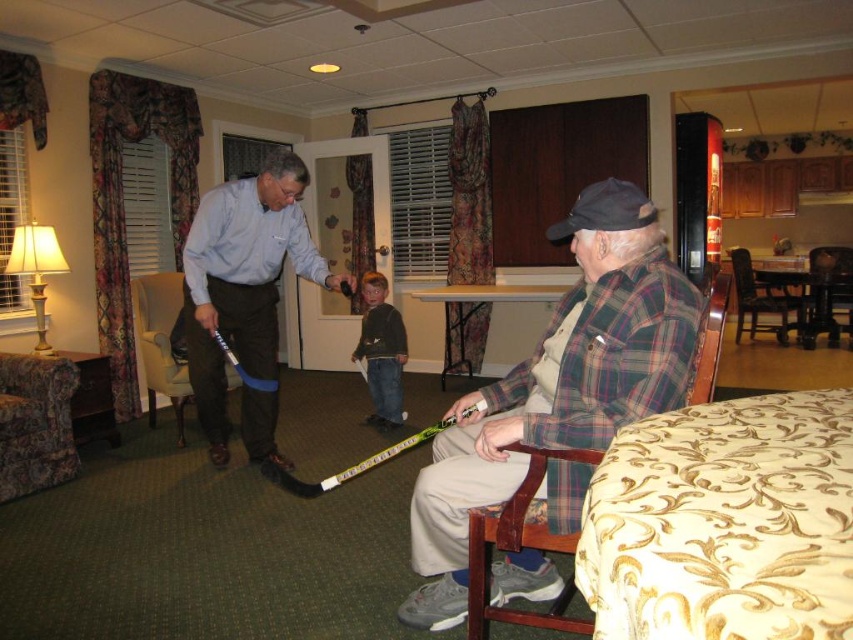
Who is shorter, dark gray fleece jacket at center or wooden chair at right?

With less height is wooden chair at right.

The width and height of the screenshot is (853, 640). What are the coordinates of `dark gray fleece jacket at center` in the screenshot? It's located at (381, 352).

Locate an element on the screen. The image size is (853, 640). dark gray fleece jacket at center is located at coordinates (381, 352).

Is wooden armchair at lower center further to the viewer compared to wooden chair at right?

Answer: No, wooden armchair at lower center is closer to the viewer.

Between wooden armchair at lower center and wooden chair at right, which one appears on the left side from the viewer's perspective?

wooden armchair at lower center is more to the left.

Is point (490, 515) more distant than point (822, 314)?

No, it is not.

You are a GUI agent. You are given a task and a screenshot of the screen. Output one action in this format:
    pyautogui.click(x=<x>, y=<y>)
    Task: Click on the wooden armchair at lower center
    Image resolution: width=853 pixels, height=640 pixels.
    Given the screenshot: What is the action you would take?
    pyautogui.click(x=521, y=547)

Is light blue shirt at center in front of wooden chair at right?

Yes, it is.

Can you confirm if light blue shirt at center is wider than wooden chair at right?

Indeed, light blue shirt at center has a greater width compared to wooden chair at right.

What do you see at coordinates (242, 280) in the screenshot? I see `light blue shirt at center` at bounding box center [242, 280].

At what (x,y) coordinates should I click in order to perform the action: click on light blue shirt at center. Please return your answer as a coordinate pair (x, y). The height and width of the screenshot is (640, 853). Looking at the image, I should click on (242, 280).